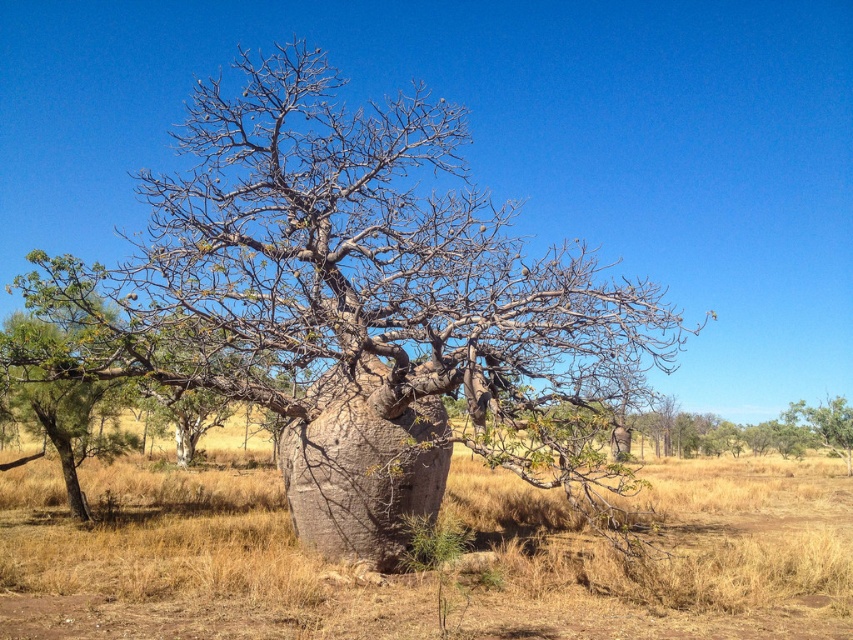
You are a hiker standing at the edge of the savanna and see the gray textured tree at center and the brown dry grass at center. Which object is positioned to the right side of the other?

The gray textured tree at center is to the right of brown dry grass at center.

You are a hiker who wants to take a photo of the gray textured tree at center and the brown dry grass at center. Which object should you focus on first if you want both to be in sharp focus?

The gray textured tree at center is positioned over brown dry grass at center, so you should focus on the gray textured tree at center first since it is closer to the camera.

You are an environmental scientist studying the savanna ecosystem. You observe the gray textured tree at center and the brown dry grass at center. Which of these two would likely cast a larger shadow during midday when the sun is directly overhead?

The gray textured tree at center is larger in size than the brown dry grass at center, so it would cast a larger shadow during midday when the sun is directly overhead.